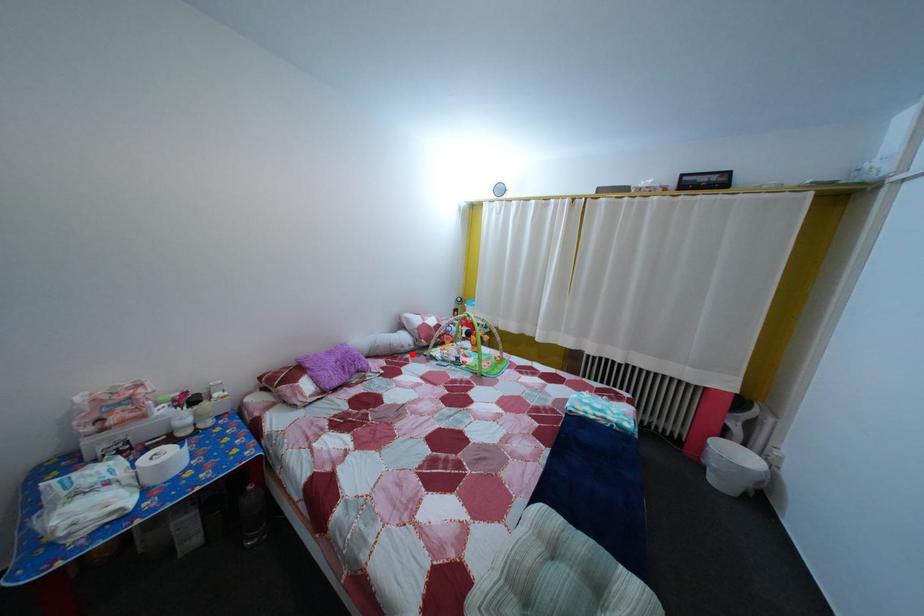
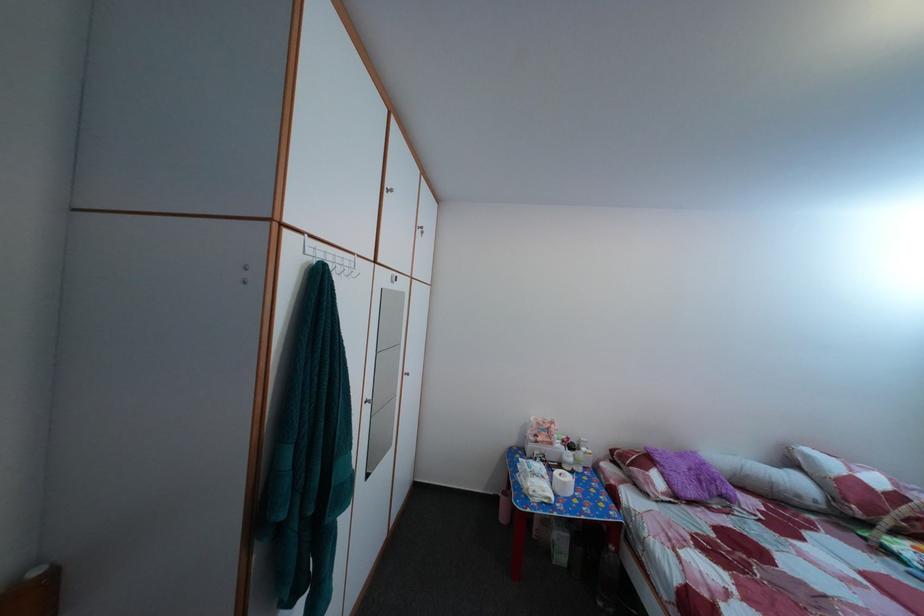
In the second image, find the point that corresponds to the highlighted location in the first image.

(808, 504)